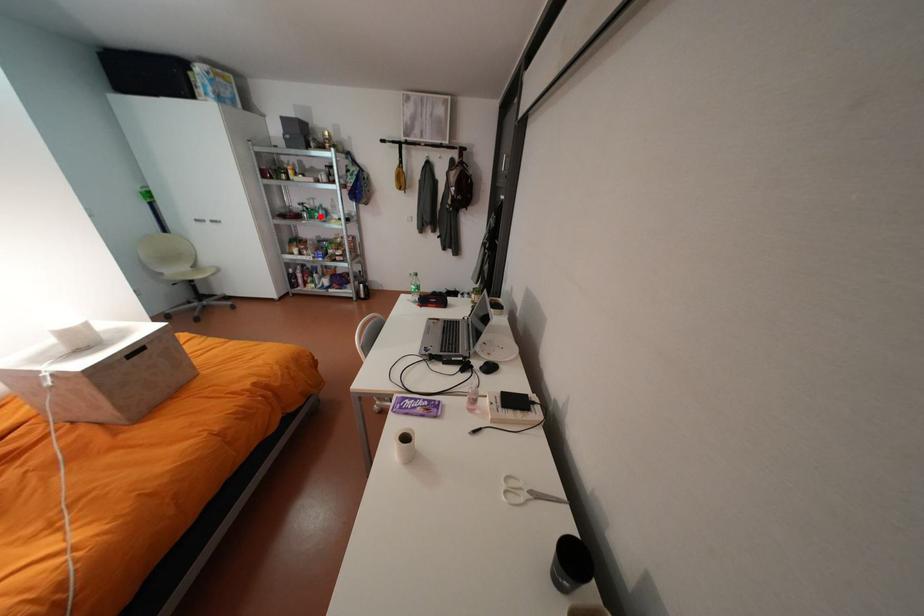
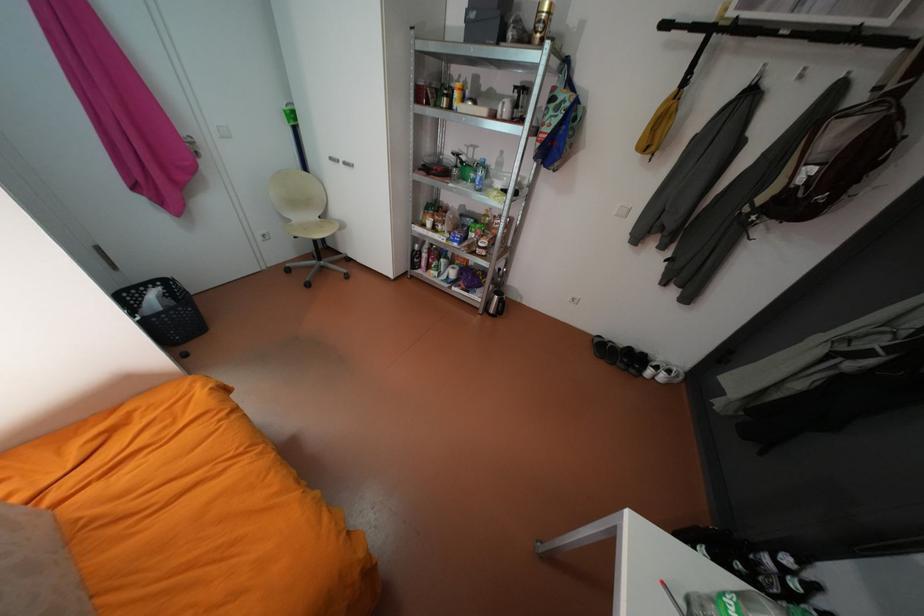
In the second image, find the point that corresponds to the highlighted location in the first image.

(471, 177)